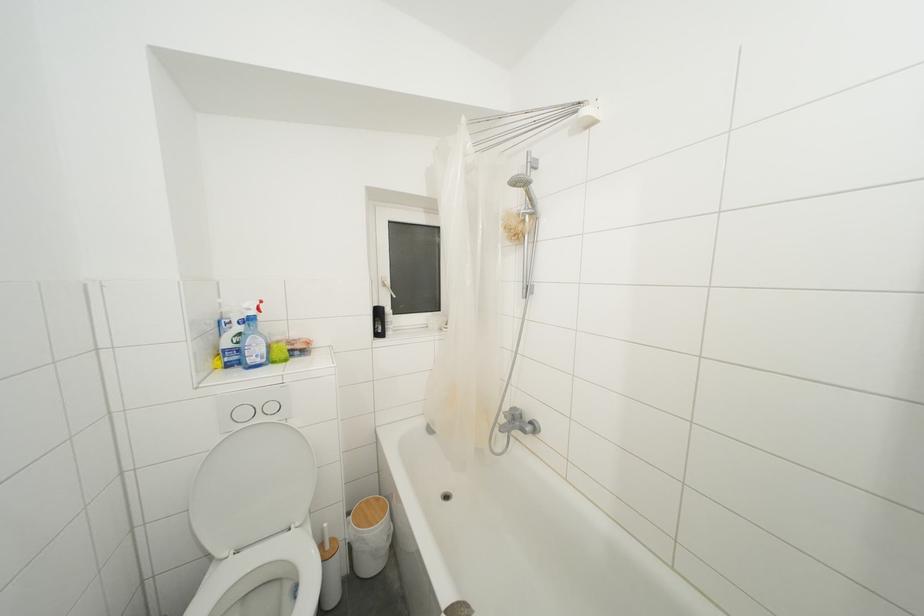
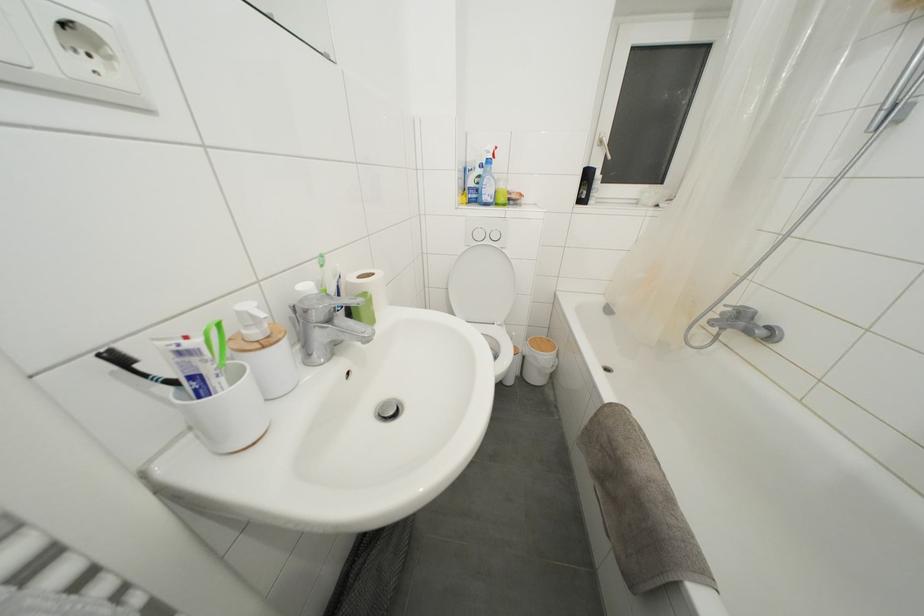
Find the pixel in the second image that matches (x=509, y=421) in the first image.

(726, 318)